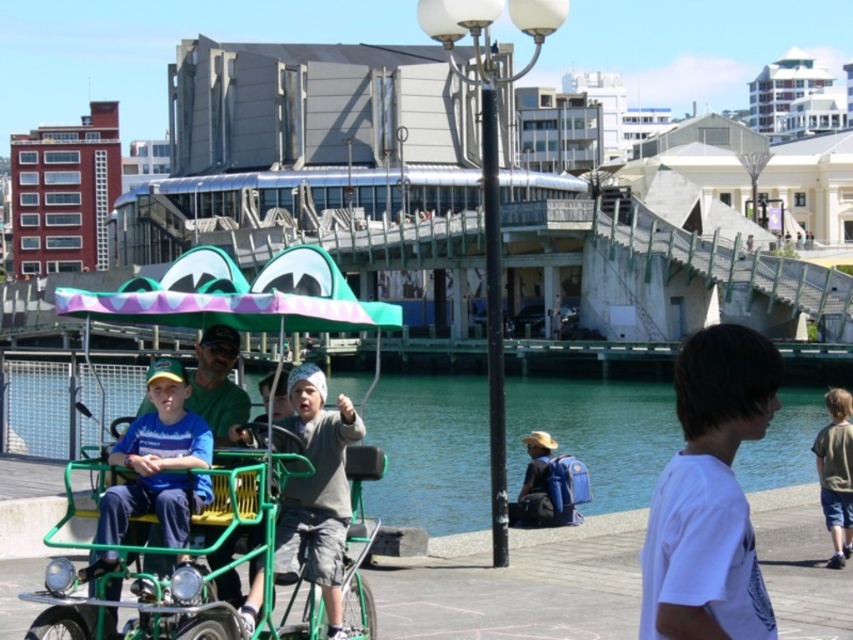
Question: Which point is closer to the camera taking this photo?

Choices:
 (A) (561, 397)
 (B) (73, 637)
 (C) (833, 436)
 (D) (144, 474)

Answer: (B)

Question: Which is farther from the white matte shirt at lower right?

Choices:
 (A) blue matte shirt at center
 (B) dark green fabric shorts at lower right
 (C) green metallic water at center

Answer: (C)

Question: Which object is positioned closest to the dark green fabric shorts at lower right?

Choices:
 (A) green metallic water at center
 (B) blue matte shirt at center

Answer: (B)

Question: Can you confirm if green matte tricycle at center is bigger than blue matte shirt at center?

Choices:
 (A) no
 (B) yes

Answer: (B)

Question: Is green metallic water at center wider than dark green fabric shorts at lower right?

Choices:
 (A) no
 (B) yes

Answer: (B)

Question: Is green matte tricycle at center to the left of dark green fabric shorts at lower right from the viewer's perspective?

Choices:
 (A) no
 (B) yes

Answer: (B)